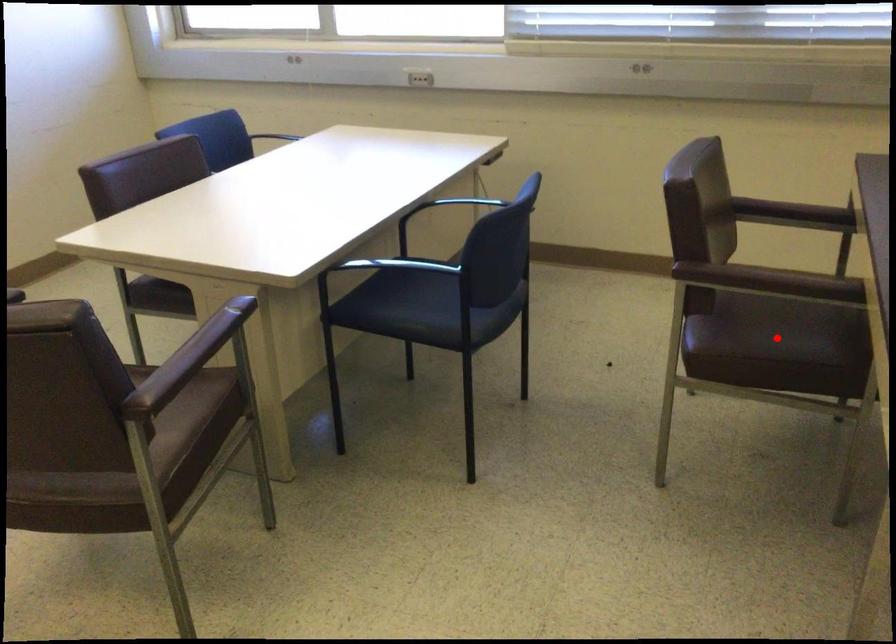
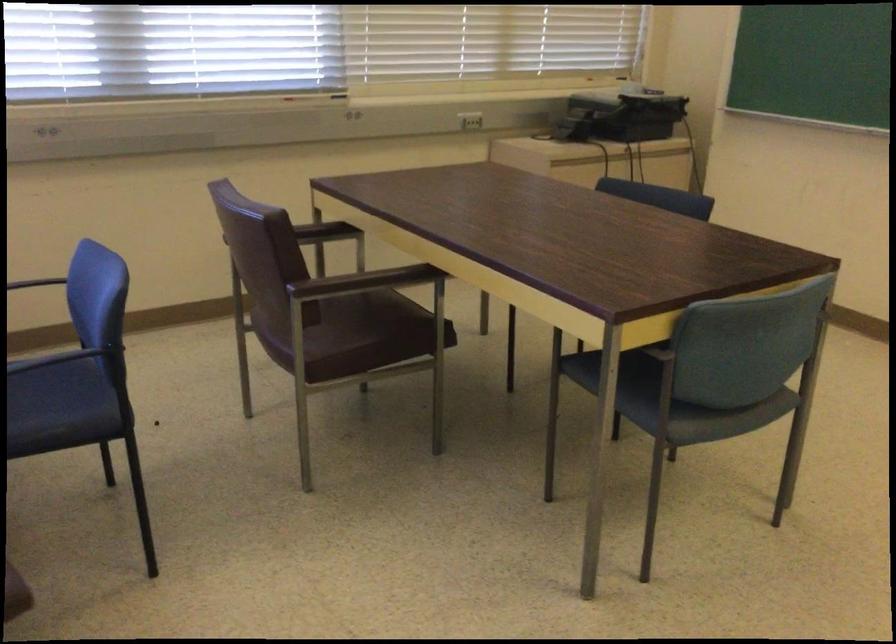
Find the pixel in the second image that matches the highlighted location in the first image.

(371, 330)